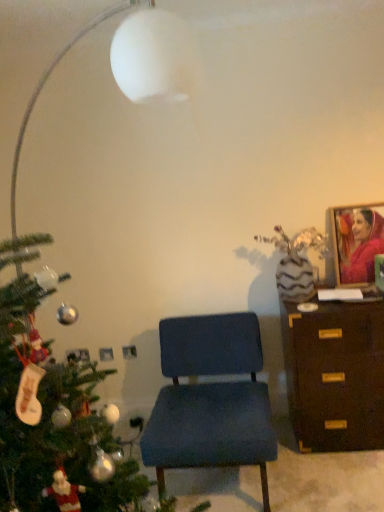
Question: Is matte pink fabric portrait at upper right facing towards brown wooden chest of drawers at right?

Choices:
 (A) no
 (B) yes

Answer: (A)

Question: Is matte pink fabric portrait at upper right not close to brown wooden chest of drawers at right?

Choices:
 (A) no
 (B) yes

Answer: (A)

Question: Is matte pink fabric portrait at upper right at the left side of brown wooden chest of drawers at right?

Choices:
 (A) no
 (B) yes

Answer: (A)

Question: From a real-world perspective, is matte pink fabric portrait at upper right located beneath brown wooden chest of drawers at right?

Choices:
 (A) no
 (B) yes

Answer: (A)

Question: Is matte pink fabric portrait at upper right thinner than brown wooden chest of drawers at right?

Choices:
 (A) no
 (B) yes

Answer: (B)

Question: From a real-world perspective, is matte pink fabric portrait at upper right on brown wooden chest of drawers at right?

Choices:
 (A) yes
 (B) no

Answer: (A)

Question: Considering the relative sizes of brown wooden chest of drawers at right and matte pink fabric portrait at upper right in the image provided, is brown wooden chest of drawers at right wider than matte pink fabric portrait at upper right?

Choices:
 (A) no
 (B) yes

Answer: (B)

Question: Is brown wooden chest of drawers at right not close to matte pink fabric portrait at upper right?

Choices:
 (A) yes
 (B) no

Answer: (B)

Question: Is brown wooden chest of drawers at right behind matte pink fabric portrait at upper right?

Choices:
 (A) no
 (B) yes

Answer: (A)

Question: Is brown wooden chest of drawers at right to the right of matte pink fabric portrait at upper right from the viewer's perspective?

Choices:
 (A) no
 (B) yes

Answer: (A)

Question: Can you confirm if brown wooden chest of drawers at right is bigger than matte pink fabric portrait at upper right?

Choices:
 (A) yes
 (B) no

Answer: (A)

Question: Does brown wooden chest of drawers at right have a lesser height compared to matte pink fabric portrait at upper right?

Choices:
 (A) no
 (B) yes

Answer: (A)

Question: Is blue fabric chair at center aimed at brown wooden chest of drawers at right?

Choices:
 (A) yes
 (B) no

Answer: (B)